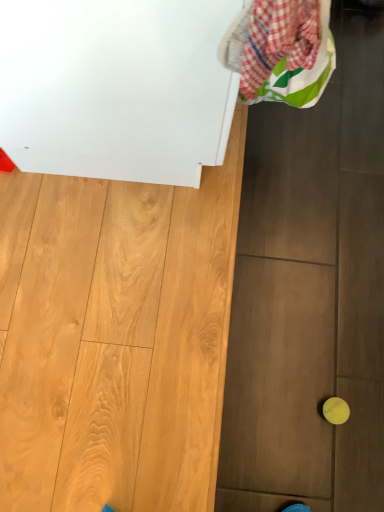
Question: Can you confirm if white glossy cabinet at upper left is shorter than plaid fabric laundry at upper right?

Choices:
 (A) no
 (B) yes

Answer: (A)

Question: Considering the relative positions of white glossy cabinet at upper left and plaid fabric laundry at upper right in the image provided, is white glossy cabinet at upper left to the right of plaid fabric laundry at upper right from the viewer's perspective?

Choices:
 (A) no
 (B) yes

Answer: (A)

Question: Can you confirm if white glossy cabinet at upper left is smaller than plaid fabric laundry at upper right?

Choices:
 (A) no
 (B) yes

Answer: (A)

Question: Does white glossy cabinet at upper left have a greater height compared to plaid fabric laundry at upper right?

Choices:
 (A) no
 (B) yes

Answer: (B)

Question: Is white glossy cabinet at upper left positioned behind plaid fabric laundry at upper right?

Choices:
 (A) yes
 (B) no

Answer: (A)

Question: Considering the relative sizes of white glossy cabinet at upper left and plaid fabric laundry at upper right in the image provided, is white glossy cabinet at upper left thinner than plaid fabric laundry at upper right?

Choices:
 (A) yes
 (B) no

Answer: (B)

Question: Is plaid fabric laundry at upper right oriented away from yellow rubber ball at lower right?

Choices:
 (A) yes
 (B) no

Answer: (B)

Question: Does plaid fabric laundry at upper right have a greater width compared to yellow rubber ball at lower right?

Choices:
 (A) yes
 (B) no

Answer: (A)

Question: From a real-world perspective, is plaid fabric laundry at upper right below yellow rubber ball at lower right?

Choices:
 (A) no
 (B) yes

Answer: (A)

Question: Is plaid fabric laundry at upper right further to camera compared to yellow rubber ball at lower right?

Choices:
 (A) yes
 (B) no

Answer: (B)

Question: Considering the relative sizes of plaid fabric laundry at upper right and yellow rubber ball at lower right in the image provided, is plaid fabric laundry at upper right thinner than yellow rubber ball at lower right?

Choices:
 (A) no
 (B) yes

Answer: (A)

Question: Are plaid fabric laundry at upper right and yellow rubber ball at lower right making contact?

Choices:
 (A) yes
 (B) no

Answer: (B)

Question: Does yellow rubber ball at lower right come in front of plaid fabric laundry at upper right?

Choices:
 (A) yes
 (B) no

Answer: (B)